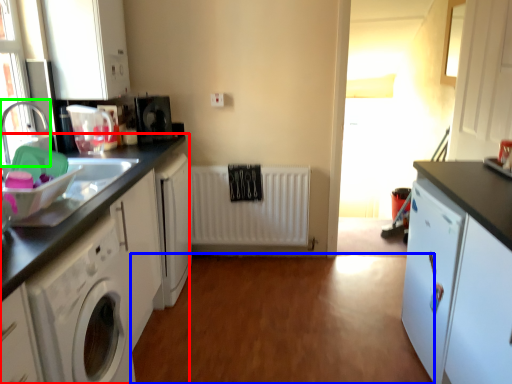
Question: Based on their relative distances, which object is nearer to cabinetry (highlighted by a red box)? Choose from plain (highlighted by a blue box) and faucet (highlighted by a green box).

Choices:
 (A) plain
 (B) faucet

Answer: (B)